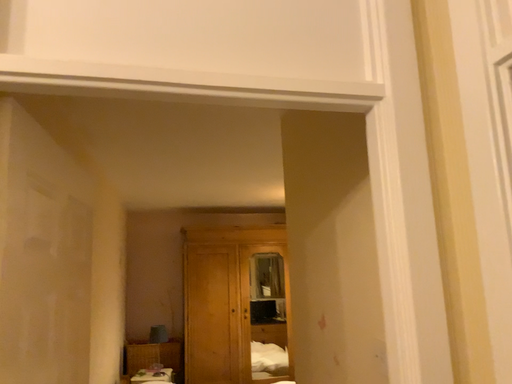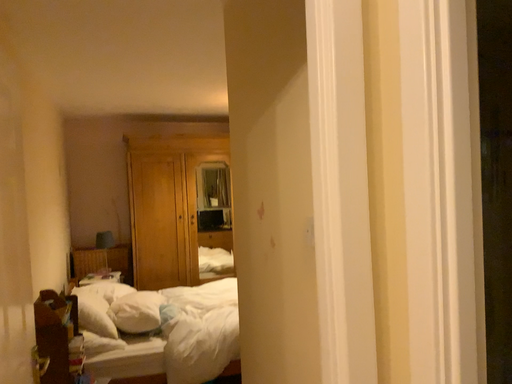
Question: How did the camera likely rotate when shooting the video?

Choices:
 (A) rotated downward
 (B) rotated upward

Answer: (A)